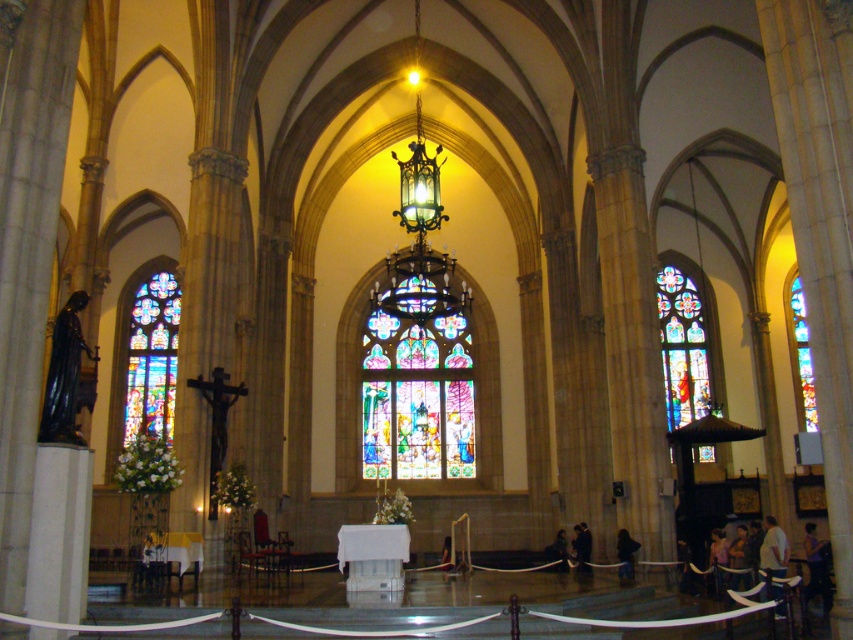
You are standing in the cathedral and want to move from the entrance to the altar. There are two points marked in the image, point 1 at coordinates point (451, 404) and point 2 at coordinates point (630, 536). Which point should you head towards to reach the altar first?

Point (451, 404) is behind point (630, 536), so you should head towards point (630, 536) first to reach the altar.

You are standing in the cathedral and want to take a photo of the multicolored stained glass at right and the dark skin textured person at lower right. Which object is wider in the image?

The multicolored stained glass at right is wider than the dark skin textured person at lower right.

You are standing in the cathedral and want to move from the entrance to the altar. You notice two points marked on the floor at coordinates point (x=805, y=410) and point (x=770, y=566). Which point should you step on first to reach the altar?

You should step on point (x=770, y=566) first because point (x=805, y=410) is behind it, meaning point (x=770, y=566) is closer to your starting position at the entrance.